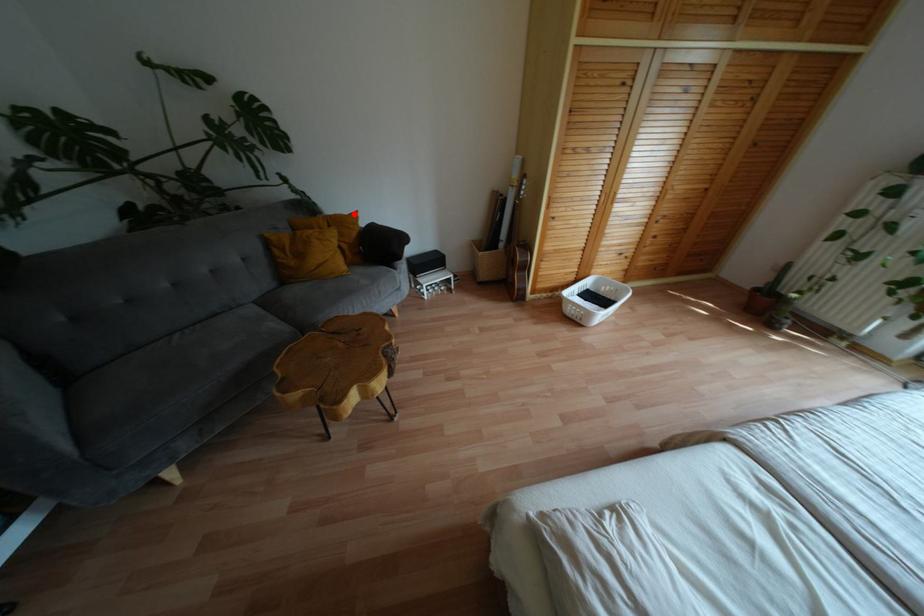
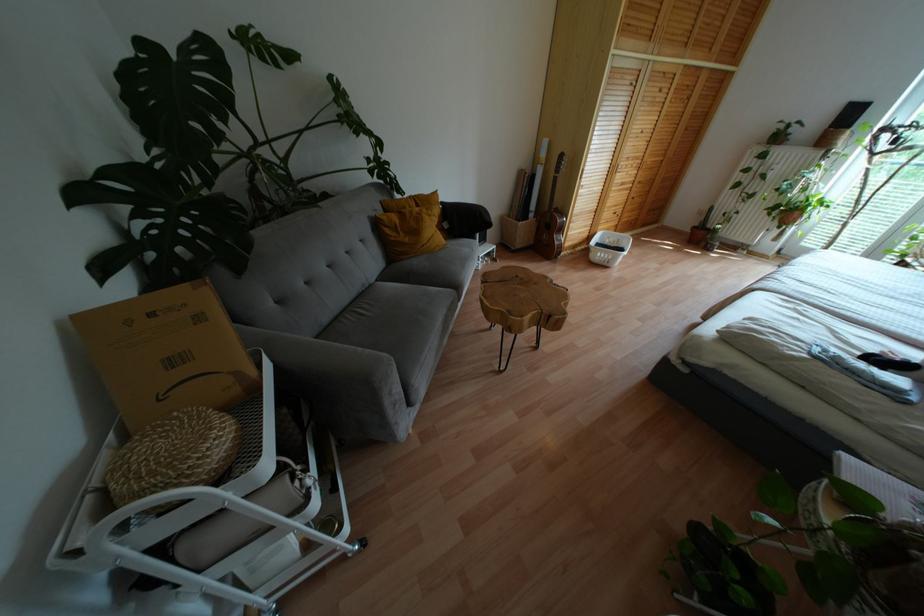
Locate, in the second image, the point that corresponds to the highlighted location in the first image.

(434, 193)